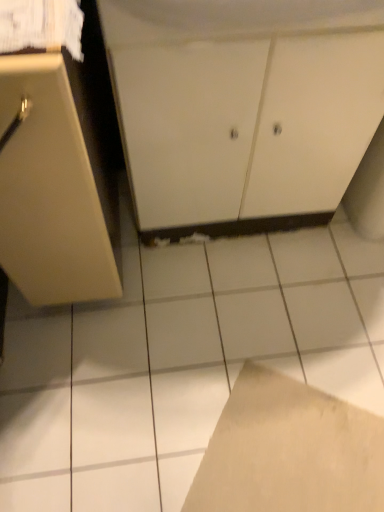
This screenshot has width=384, height=512. In order to click on vacant area that lies in front of white matte cabinet at center, positioned as the 1th cabinetry in right-to-left order in this screenshot , I will do `click(233, 320)`.